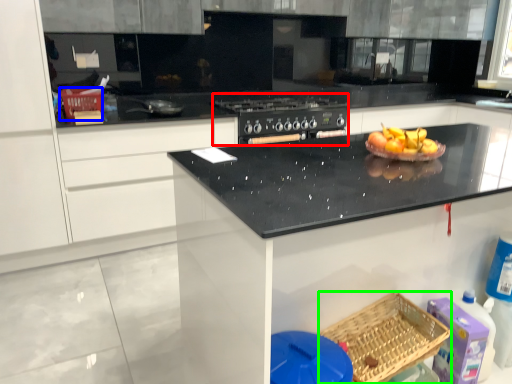
Question: Considering the real-world distances, which object is closest to appliance (highlighted by a red box)? basket (highlighted by a blue box) or basket (highlighted by a green box).

Choices:
 (A) basket
 (B) basket

Answer: (A)